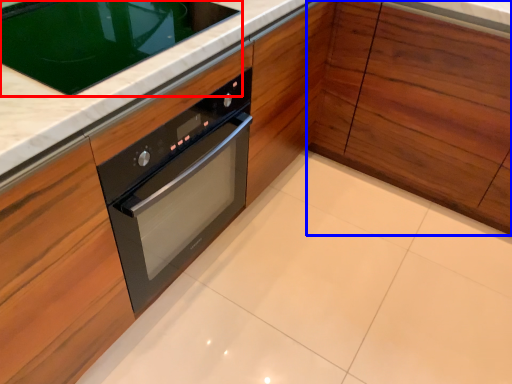
Question: Among these objects, which one is nearest to the camera, home appliance (highlighted by a red box) or cabinetry (highlighted by a blue box)?

Choices:
 (A) home appliance
 (B) cabinetry

Answer: (A)